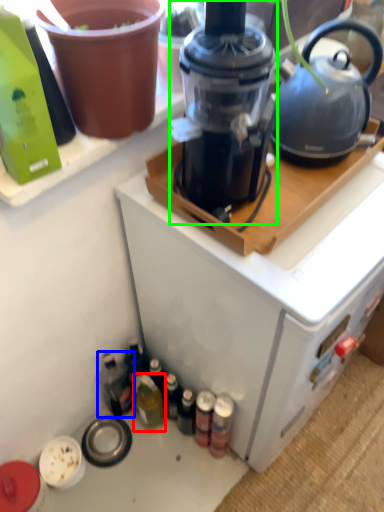
Question: Considering the real-world distances, which object is closest to bottle (highlighted by a red box)? bottle (highlighted by a blue box) or blender (highlighted by a green box).

Choices:
 (A) bottle
 (B) blender

Answer: (A)